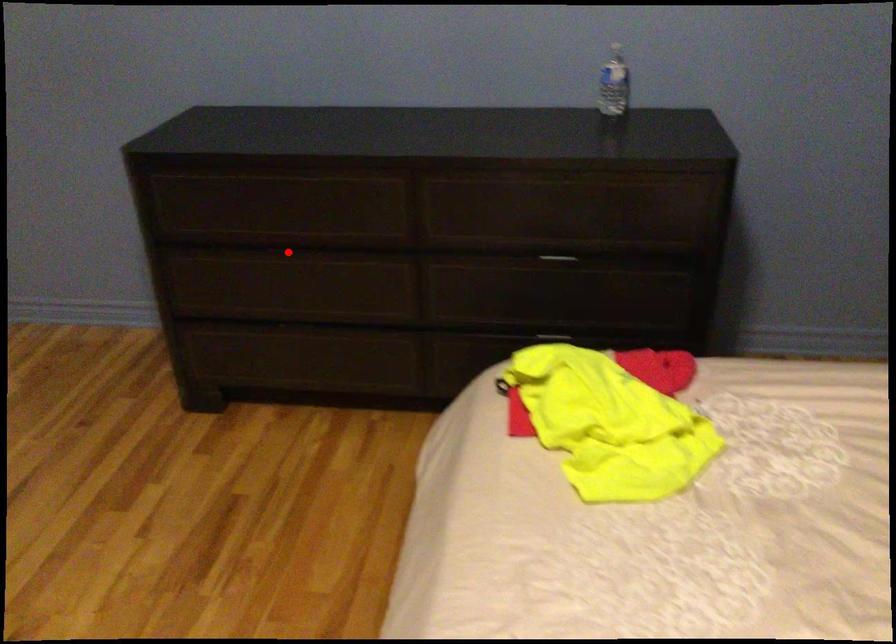
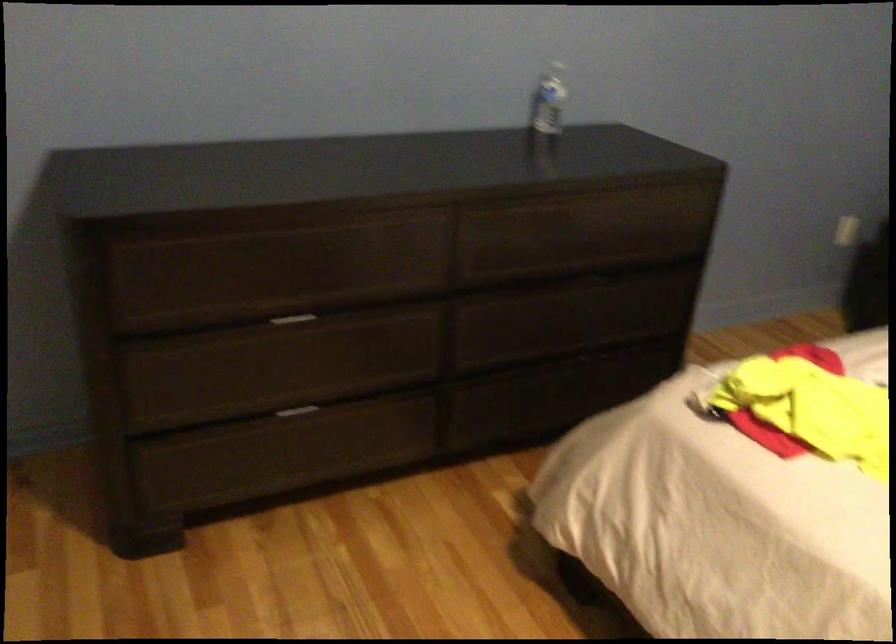
Locate, in the second image, the point that corresponds to the highlighted location in the first image.

(291, 319)